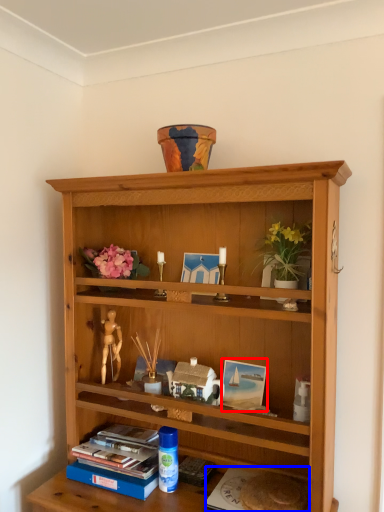
Question: Which object appears farthest to the camera in this image, picture frame (highlighted by a red box) or paperback book (highlighted by a blue box)?

Choices:
 (A) picture frame
 (B) paperback book

Answer: (A)